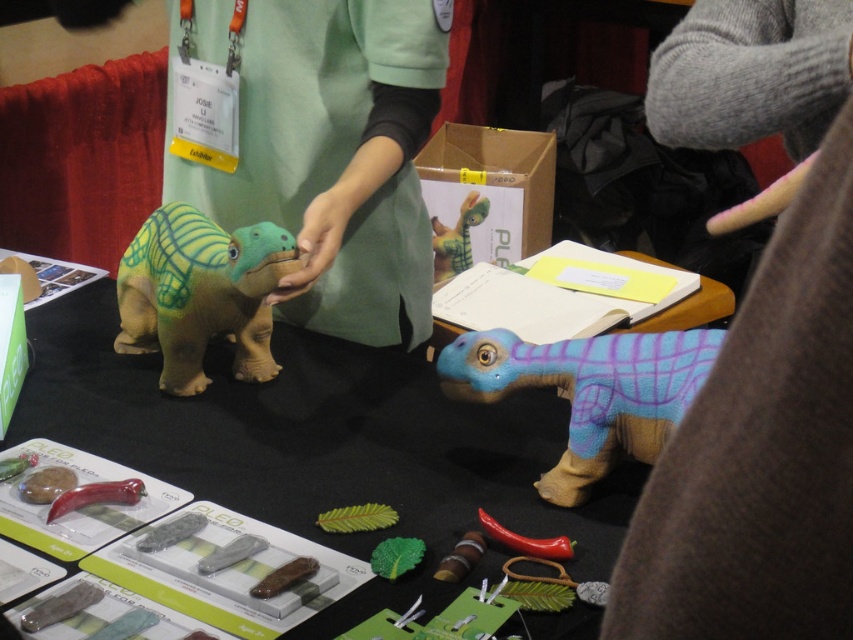
You are standing at the camera position and want to reach point (688, 349). Can you step forward 1 meter to get there?

The distance between point (688, 349) and the camera is 92.87 centimeters. Since 92.87 cm is less than 1 meter, stepping forward 1 meter would overshoot the point by 61.13 centimeters.

You are setting up a display at a dinosaur event. You have a soft plush dinosaur at center and a green fabric dinosaur at center. Where should you place the new informational sign so it doesn

The soft plush dinosaur at center is located below the green fabric dinosaur at center. Therefore, placing the informational sign above the green fabric dinosaur at center would ensure it is visible while avoiding obstruction from the soft plush dinosaur at center.